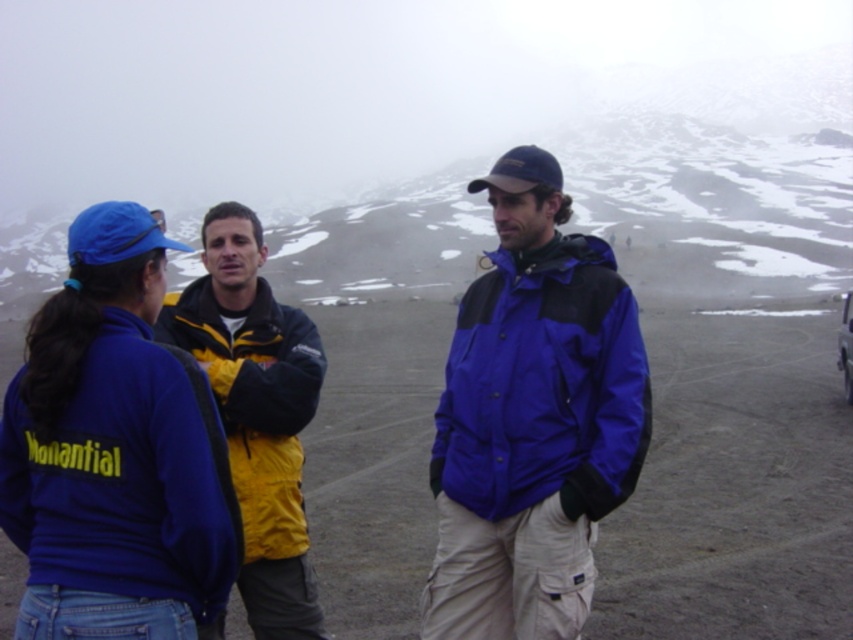
Between blue matte jacket at center and metallic silver car at right, which one is positioned lower?

Positioned lower is blue matte jacket at center.

Between point (567, 355) and point (849, 396), which one is positioned behind?

Point (849, 396)

The height and width of the screenshot is (640, 853). What are the coordinates of `blue matte jacket at center` in the screenshot? It's located at (532, 419).

Identify the location of blue matte jacket at center. The height and width of the screenshot is (640, 853). (532, 419).

Between point (561, 492) and point (282, 580), which one is positioned behind?

Point (282, 580)

Between blue matte jacket at center and yellow fabric jacket at center, which one has less height?

yellow fabric jacket at center

Describe the element at coordinates (532, 419) in the screenshot. The image size is (853, 640). I see `blue matte jacket at center` at that location.

Locate an element on the screen. This screenshot has width=853, height=640. blue matte jacket at center is located at coordinates (532, 419).

Can you confirm if blue fleece jacket at left is bigger than metallic silver car at right?

No, blue fleece jacket at left is not bigger than metallic silver car at right.

Based on the photo, who is positioned more to the left, blue fleece jacket at left or metallic silver car at right?

blue fleece jacket at left

Is point (68, 477) farther from viewer compared to point (846, 304)?

No, (68, 477) is in front of (846, 304).

What are the coordinates of `blue fleece jacket at left` in the screenshot? It's located at (109, 452).